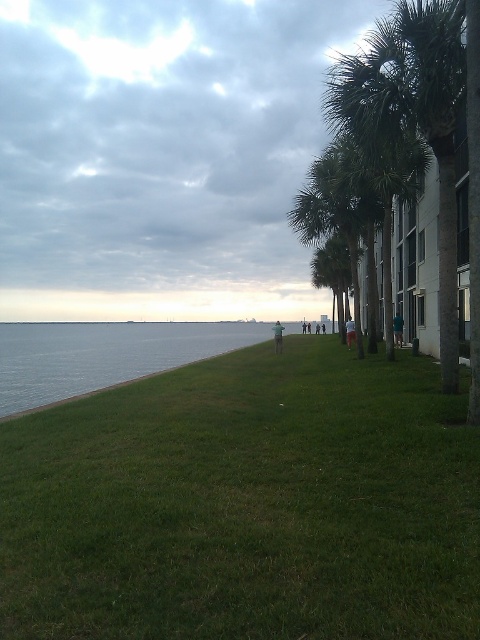
Does green fabric pants at center-right appear over light blue shirt at center?

Yes.

The height and width of the screenshot is (640, 480). What are the coordinates of `green fabric pants at center-right` in the screenshot? It's located at (397, 330).

Does green grassy at lower left have a smaller size compared to light brown leather jacket at center?

No, green grassy at lower left is not smaller than light brown leather jacket at center.

Is point (249, 513) positioned after point (276, 353)?

No.

The image size is (480, 640). In order to click on green grassy at lower left in this screenshot , I will do `click(247, 504)`.

Is point (70, 456) closer to viewer compared to point (349, 326)?

Yes, point (70, 456) is in front of point (349, 326).

How much distance is there between green grassy at lower left and light blue shirt at center?

green grassy at lower left and light blue shirt at center are 15.66 meters apart.

Who is more distant from viewer, (148, 401) or (348, 332)?

The point (348, 332) is more distant.

At what (x,y) coordinates should I click in order to perform the action: click on green grassy at lower left. Please return your answer as a coordinate pair (x, y). The image size is (480, 640). Looking at the image, I should click on (247, 504).